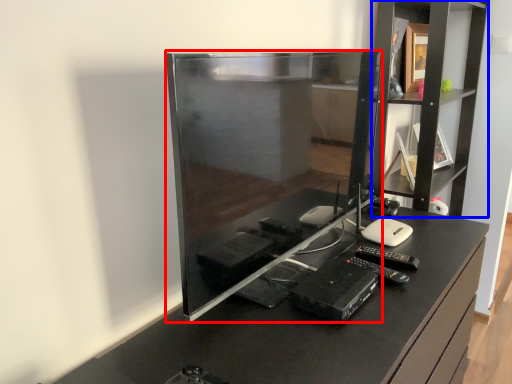
Question: Which object appears farthest to the camera in this image, desktop computer (highlighted by a red box) or shelf (highlighted by a blue box)?

Choices:
 (A) desktop computer
 (B) shelf

Answer: (B)